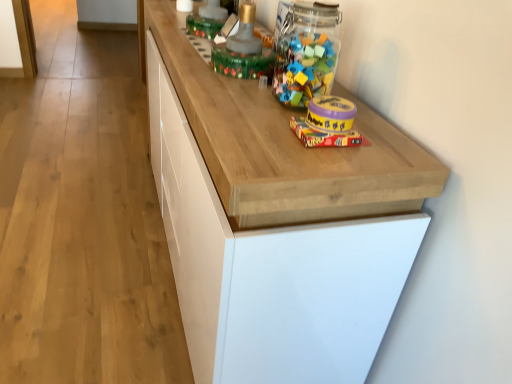
Question: Is translucent plastic container at upper center, which appears as the 4th toy when ordered from the bottom, shorter than wooden cabinet at center?

Choices:
 (A) no
 (B) yes

Answer: (B)

Question: Can you confirm if translucent plastic container at upper center, which is counted as the first toy, starting from the top, is taller than wooden cabinet at center?

Choices:
 (A) yes
 (B) no

Answer: (B)

Question: From the image's perspective, is translucent plastic container at upper center, which is counted as the first toy, starting from the top, over wooden cabinet at center?

Choices:
 (A) no
 (B) yes

Answer: (B)

Question: Does translucent plastic container at upper center, the 4th toy when ordered from front to back, have a larger size compared to wooden cabinet at center?

Choices:
 (A) yes
 (B) no

Answer: (B)

Question: Considering the relative sizes of translucent plastic container at upper center, which is the first toy from back to front, and wooden cabinet at center in the image provided, is translucent plastic container at upper center, which is the first toy from back to front, wider than wooden cabinet at center?

Choices:
 (A) yes
 (B) no

Answer: (B)

Question: From a real-world perspective, is translucent plastic container at upper center, which appears as the 4th toy when ordered from the bottom, located beneath wooden cabinet at center?

Choices:
 (A) yes
 (B) no

Answer: (B)

Question: From the image's perspective, is matte yellow plastic container at center, which ranks as the first toy in bottom-to-top order, below matte yellow plastic container at upper right, acting as the 2th toy starting from the bottom?

Choices:
 (A) no
 (B) yes

Answer: (B)

Question: Is matte yellow plastic container at center, the second toy in the front-to-back sequence, at the left side of matte yellow plastic container at upper right, which ranks as the third toy in top-to-bottom order?

Choices:
 (A) yes
 (B) no

Answer: (B)

Question: Is matte yellow plastic container at center, which is the fourth toy from top to bottom, far away from matte yellow plastic container at upper right, the fourth toy from the back?

Choices:
 (A) yes
 (B) no

Answer: (B)

Question: Is matte yellow plastic container at center, the second toy in the front-to-back sequence, further to camera compared to matte yellow plastic container at upper right, the fourth toy from the back?

Choices:
 (A) yes
 (B) no

Answer: (A)

Question: Does matte yellow plastic container at center, which is the fourth toy from top to bottom, lie in front of matte yellow plastic container at upper right, which ranks as the third toy in top-to-bottom order?

Choices:
 (A) yes
 (B) no

Answer: (B)

Question: Does matte yellow plastic container at center, which is the third toy from back to front, have a smaller size compared to matte yellow plastic container at upper right, which ranks as the third toy in top-to-bottom order?

Choices:
 (A) no
 (B) yes

Answer: (B)

Question: Does matte yellow plastic container at upper right, which ranks as the third toy in top-to-bottom order, have a greater height compared to matte yellow plastic container at center, which ranks as the first toy in bottom-to-top order?

Choices:
 (A) no
 (B) yes

Answer: (B)